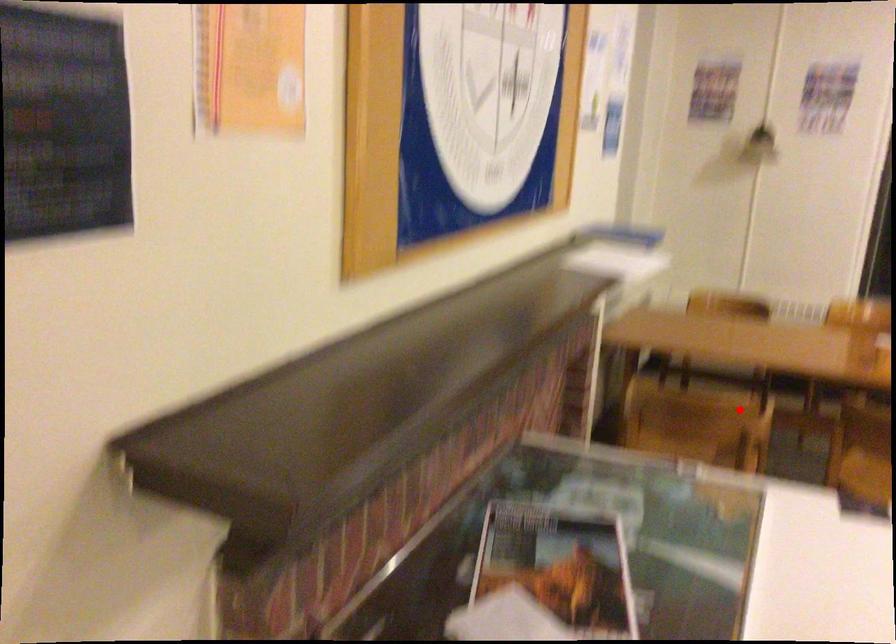
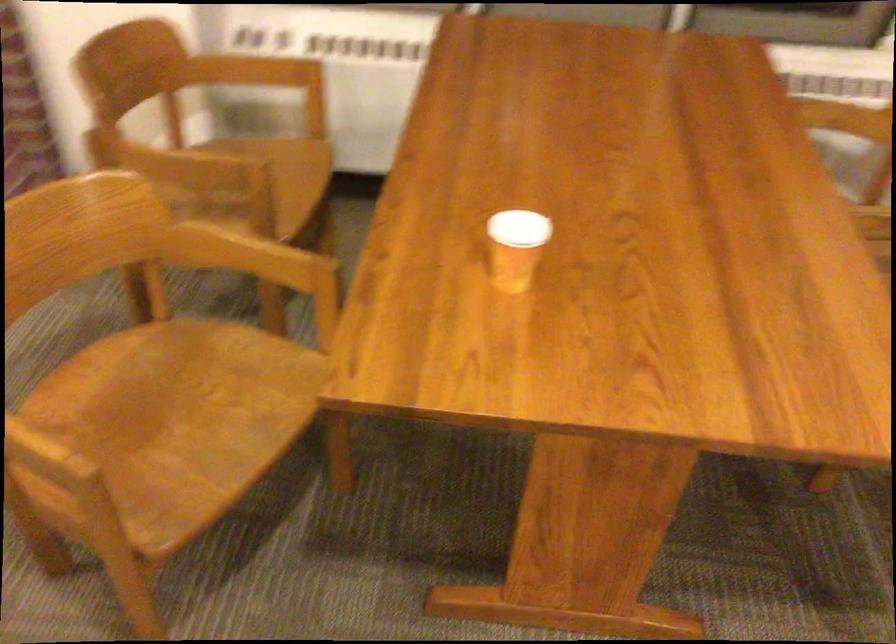
Locate, in the second image, the point that corresponds to the highlighted location in the first image.

(169, 163)